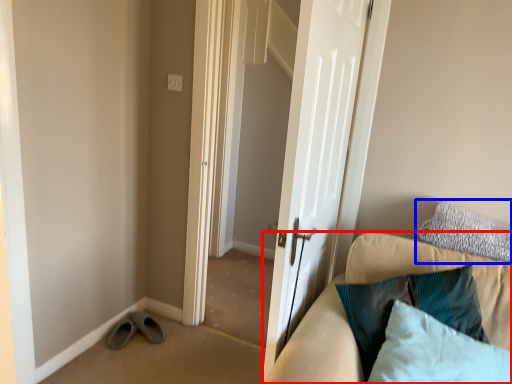
Question: Which of the following is the closest to the observer, studio couch (highlighted by a red box) or pillow (highlighted by a blue box)?

Choices:
 (A) studio couch
 (B) pillow

Answer: (A)